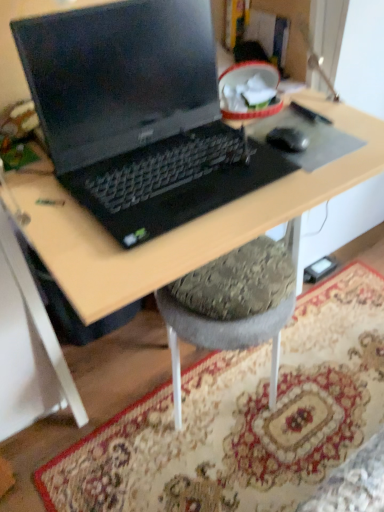
You are a GUI agent. You are given a task and a screenshot of the screen. Output one action in this format:
    pyautogui.click(x=<x>, y=<y>)
    Task: Click on the free space to the right of black rubber mouse at right
    
    Given the screenshot: What is the action you would take?
    pyautogui.click(x=327, y=144)